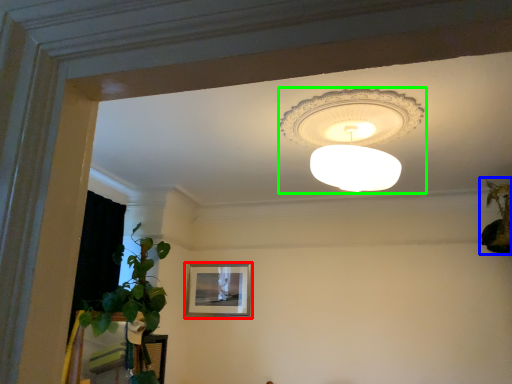
Question: Which is nearer to the picture frame (highlighted by a red box)? houseplant (highlighted by a blue box) or lamp (highlighted by a green box).

Choices:
 (A) houseplant
 (B) lamp

Answer: (B)